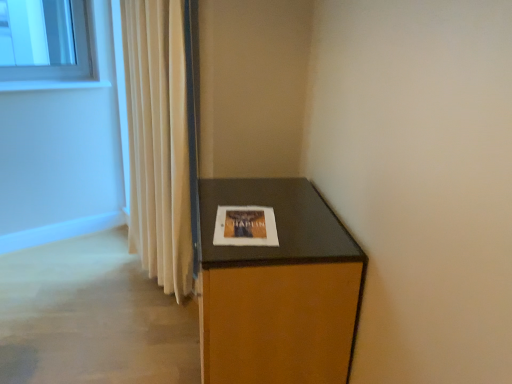
This screenshot has height=384, width=512. Identify the location of free point above brown wood cabinet at lower right (from a real-world perspective). (257, 215).